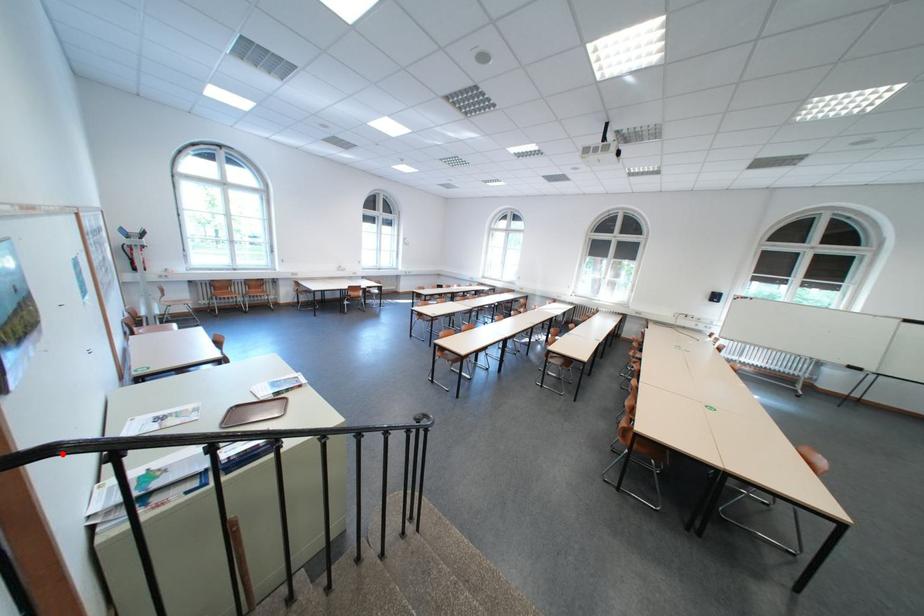
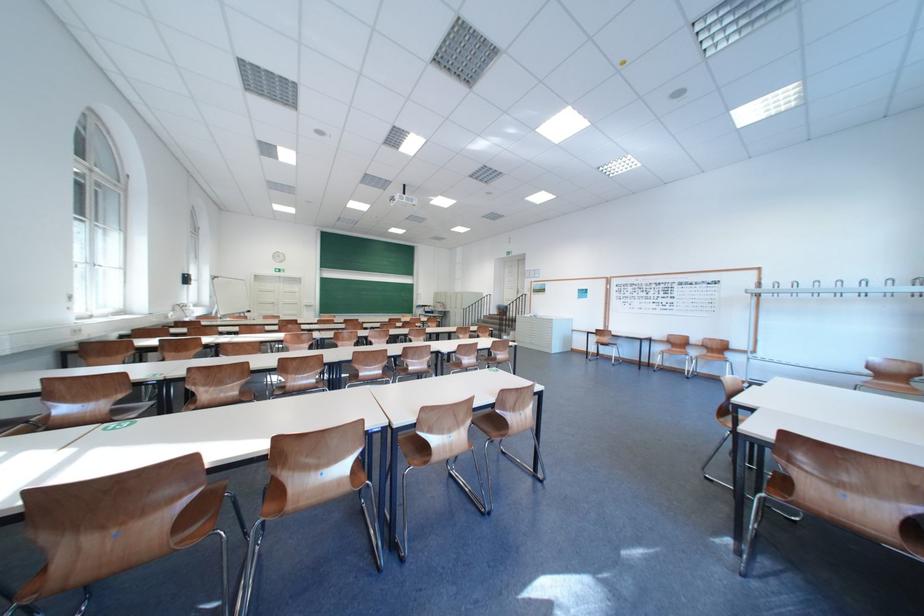
Question: I am providing you with two images of the same scene from different viewpoints. A red point is marked on the first image. Can you still see the location of the red point in image 2?

Choices:
 (A) Yes
 (B) No

Answer: (B)